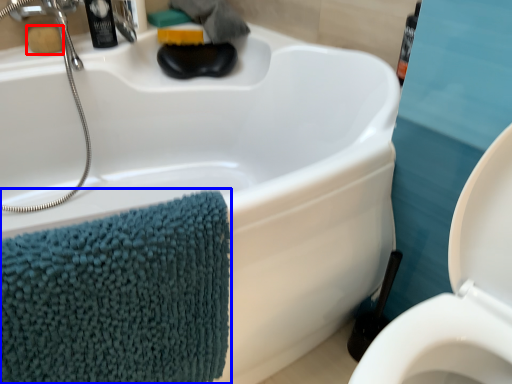
Question: Which of the following is the closest to the observer, soap (highlighted by a red box) or bath towel (highlighted by a blue box)?

Choices:
 (A) soap
 (B) bath towel

Answer: (B)